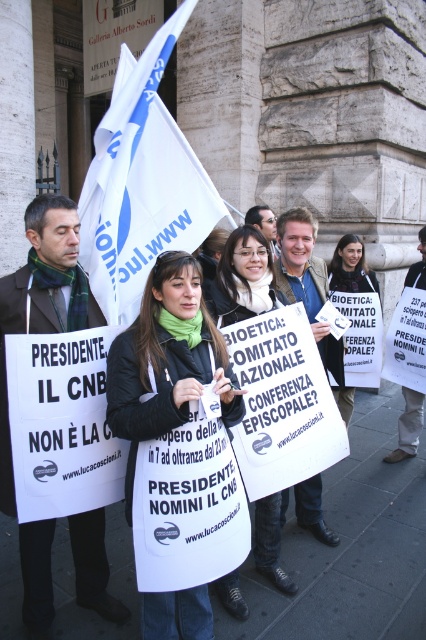
Between white paper sign at center and matte black jacket at center, which one has more height?

Standing taller between the two is matte black jacket at center.

Between white paper sign at center and matte black jacket at center, which one is positioned lower?

white paper sign at center is below.

Find the location of `white paper sign at center`. white paper sign at center is located at coordinates (242, 278).

Is white fabric flag at upper center smaller than black fabric jacket at center?

No, white fabric flag at upper center is not smaller than black fabric jacket at center.

Is point (94, 161) positioned before point (180, 419)?

That is False.

Locate an element on the screen. white fabric flag at upper center is located at coordinates (141, 182).

Between point (92, 205) and point (376, 285), which one is positioned behind?

The point (376, 285) is more distant.

Is white fabric flag at upper center positioned behind matte black jacket at center?

No, it is in front of matte black jacket at center.

Which is in front, point (135, 202) or point (347, 241)?

Point (135, 202) is more forward.

At what (x,y) coordinates should I click in order to perform the action: click on white fabric flag at upper center. Please return your answer as a coordinate pair (x, y). Image resolution: width=426 pixels, height=640 pixels. Looking at the image, I should click on (141, 182).